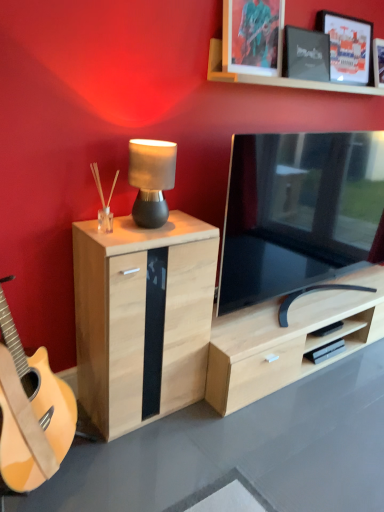
Identify the location of empty space that is ontop of natural wood cabinet at left (from a real-world perspective). The image size is (384, 512). (157, 227).